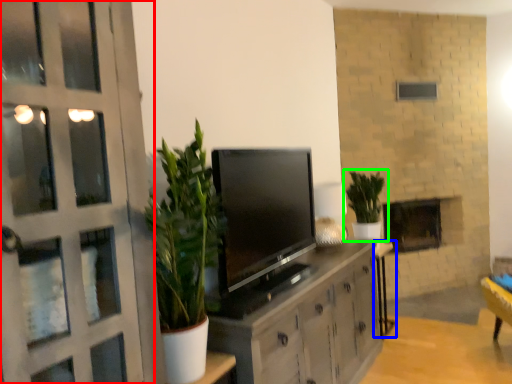
Question: Which object is the closest to the door (highlighted by a red box)? Choose among these: table (highlighted by a blue box) or houseplant (highlighted by a green box).

Choices:
 (A) table
 (B) houseplant

Answer: (B)